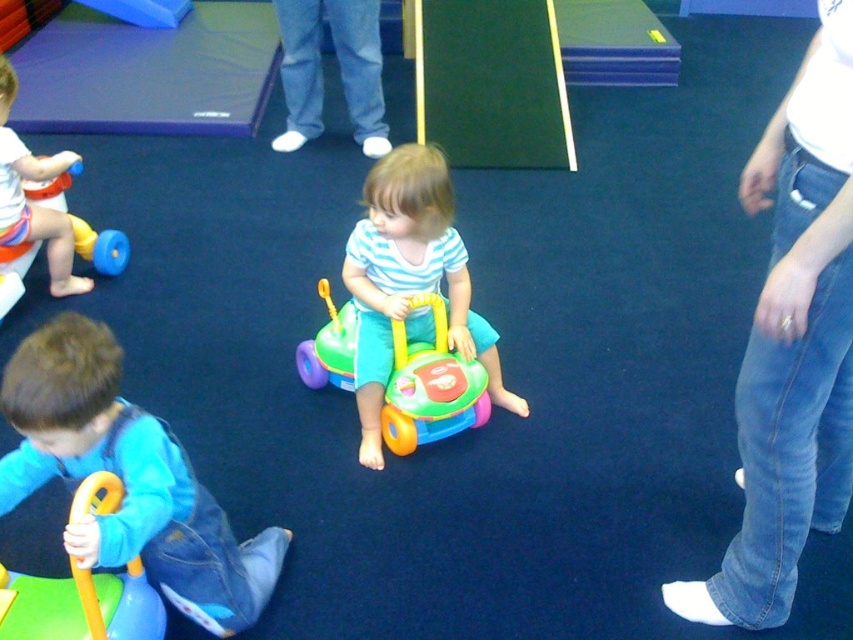
You are a parent trying to put a jacket on your child. You see the blue denim jacket at lower left and the matte plastic toy at left. Which item is bigger, and should you pick the bigger one to avoid it being too small for your child?

The blue denim jacket at lower left is larger than the matte plastic toy at left. You should choose the bigger item, the blue denim jacket at lower left, to ensure it is not too small for your child.

Based on the scene description, can you determine the spatial relationship between the striped cotton shirt at center and the rubber yellow walker at lower left?

The striped cotton shirt at center is located to the right of the rubber yellow walker at lower left.